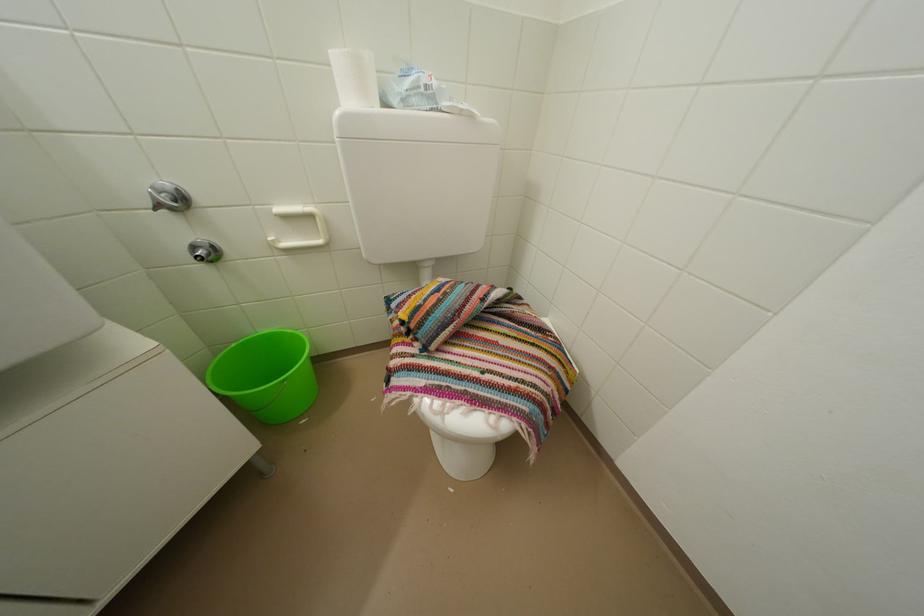
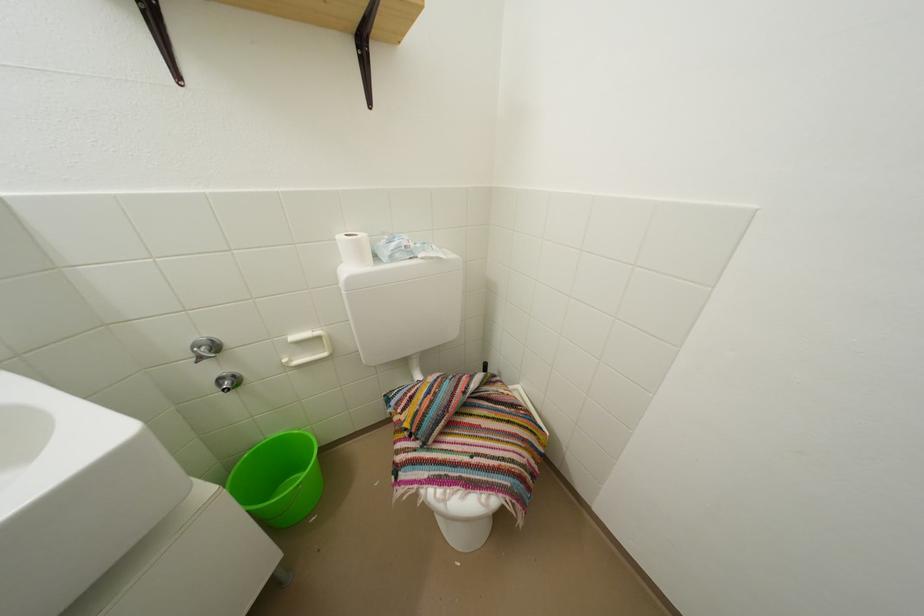
In the second image, find the point that corresponds to (203,253) in the first image.

(229, 386)